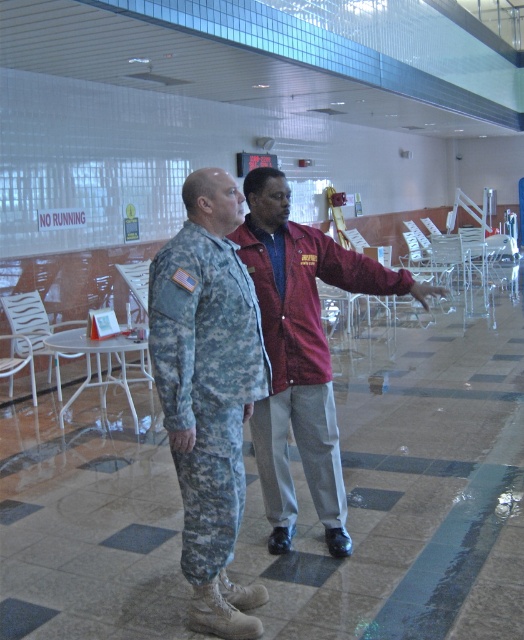
Question: Which object appears farthest from the camera in this image?

Choices:
 (A) camouflage fabric uniform at center
 (B) white plastic chair at left

Answer: (B)

Question: Is maroon fabric jacket at center positioned at the back of white plastic chair at left?

Choices:
 (A) yes
 (B) no

Answer: (B)

Question: Which object is the farthest from the white plastic chair at left?

Choices:
 (A) camouflage fabric uniform at center
 (B) maroon fabric jacket at center

Answer: (A)

Question: From the image, what is the correct spatial relationship of camouflage fabric uniform at center in relation to white plastic chair at left?

Choices:
 (A) above
 (B) below

Answer: (B)

Question: Does camouflage fabric uniform at center lie behind white plastic chair at left?

Choices:
 (A) yes
 (B) no

Answer: (B)

Question: Which object is closer to the camera taking this photo?

Choices:
 (A) maroon fabric jacket at center
 (B) white plastic chair at left

Answer: (A)